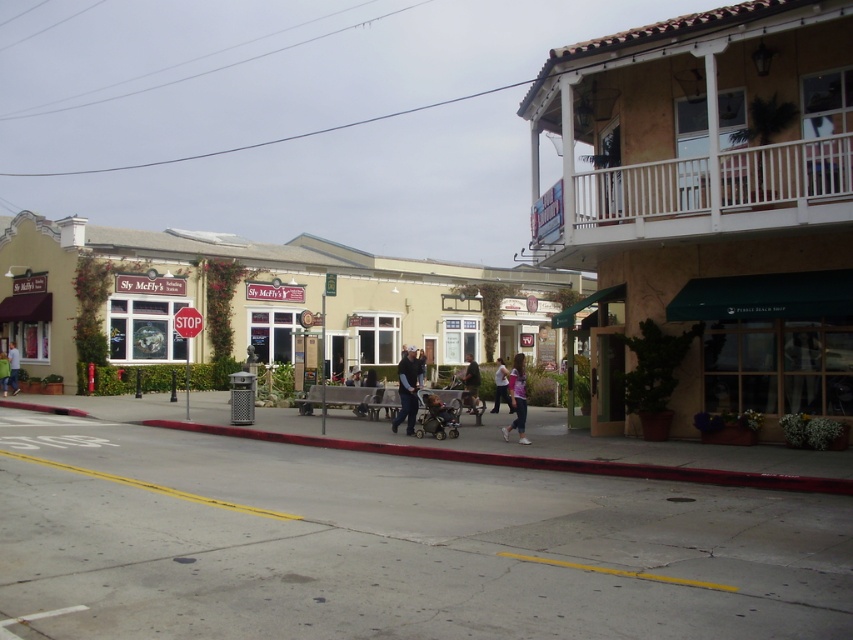
Which is above, beige stucco building at center or dark blue jeans at center?

beige stucco building at center is higher up.

Between point (364, 362) and point (405, 419), which one is positioned in front?

Point (405, 419)

What are the coordinates of `beige stucco building at center` in the screenshot? It's located at (244, 296).

Which is above, beige stucco building at upper right or beige stucco building at center?

beige stucco building at upper right

Which is below, beige stucco building at upper right or beige stucco building at center?

beige stucco building at center is lower down.

Is point (563, 99) less distant than point (316, 285)?

Yes, it is.

Where is `beige stucco building at upper right`? beige stucco building at upper right is located at coordinates (717, 193).

Is beige stucco building at upper right smaller than green fabric jacket at center?

Actually, beige stucco building at upper right might be larger than green fabric jacket at center.

What are the coordinates of `beige stucco building at upper right` in the screenshot? It's located at (717, 193).